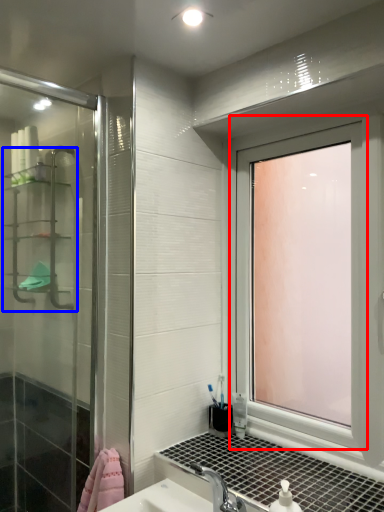
Question: Which object is closer to the camera taking this photo, window (highlighted by a red box) or shelf (highlighted by a blue box)?

Choices:
 (A) window
 (B) shelf

Answer: (A)